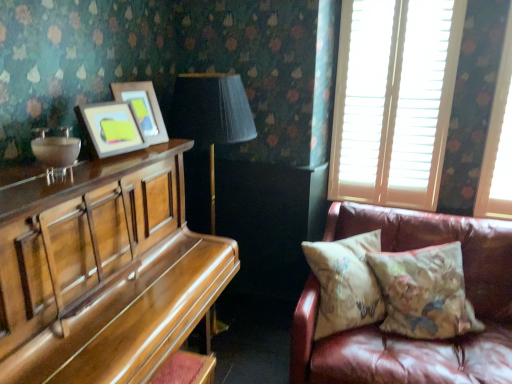
Where is `free point above white wooden blinds at upper right (from a real-world perspective)`? free point above white wooden blinds at upper right (from a real-world perspective) is located at coordinates (397, 0).